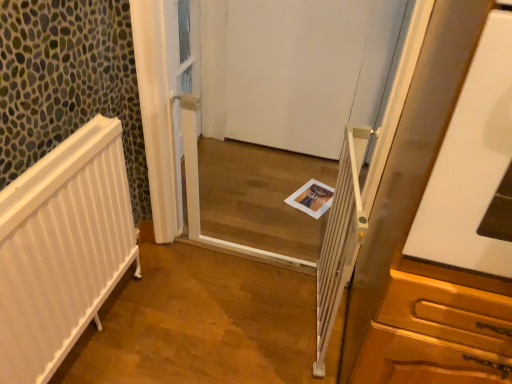
In order to face white matte radiator at left, should I rotate leftwards or rightwards?

Rotate left and turn 22.956 degrees.

The height and width of the screenshot is (384, 512). What are the coordinates of `white matte door at center` in the screenshot? It's located at (307, 70).

What do you see at coordinates (281, 115) in the screenshot? This screenshot has height=384, width=512. I see `white plastic screen door at center` at bounding box center [281, 115].

This screenshot has width=512, height=384. I want to click on white matte radiator at left, so click(62, 249).

Looking at this image, does white plastic balustrade at center touch white paper magazine at center?

No, white plastic balustrade at center is not next to white paper magazine at center.

Considering the relative positions of white plastic balustrade at center and white paper magazine at center in the image provided, is white plastic balustrade at center in front of white paper magazine at center?

Yes, white plastic balustrade at center is closer to the camera.

Is point (329, 226) farther from viewer compared to point (301, 201)?

No, it is not.

What's the angular difference between white plastic screen door at center and white matte radiator at left's facing directions?

They differ by 90.2 degrees in their facing directions.

Is white plastic screen door at center facing away from white matte radiator at left?

Yes, white matte radiator at left is at the back of white plastic screen door at center.

From the image's perspective, which one is positioned lower, white plastic screen door at center or white matte radiator at left?

white matte radiator at left is shown below in the image.

In the image, is white plastic screen door at center positioned in front of or behind white matte radiator at left?

white plastic screen door at center is positioned farther from the viewer than white matte radiator at left.

Considering the positions of point (29, 246) and point (328, 204), is point (29, 246) closer or farther from the camera than point (328, 204)?

Point (29, 246).

From the image's perspective, is white matte radiator at left beneath white paper magazine at center?

Indeed, from the image's perspective, white matte radiator at left is shown beneath white paper magazine at center.

Between white matte radiator at left and white paper magazine at center, which one has larger size?

white matte radiator at left.

Does white matte radiator at left appear on the right side of white paper magazine at center?

In fact, white matte radiator at left is to the left of white paper magazine at center.

Are white matte door at center and white paper magazine at center beside each other?

white matte door at center is not next to white paper magazine at center, and they're not touching.

Choose the correct answer: Is white matte door at center inside white paper magazine at center or outside it?

white matte door at center is located beyond the bounds of white paper magazine at center.

Could you tell me if white matte door at center is turned towards white paper magazine at center?

Yes, white matte door at center is oriented towards white paper magazine at center.

Looking at their sizes, would you say white matte door at center is wider or thinner than white paper magazine at center?

Clearly, white matte door at center has less width compared to white paper magazine at center.

Is white plastic screen door at center to the left or to the right of white matte door at center in the image?

Clearly, white plastic screen door at center is on the left of white matte door at center in the image.

Between white plastic screen door at center and white matte door at center, which one is positioned behind?

white matte door at center is behind.

Considering the relative sizes of white plastic screen door at center and white matte door at center in the image provided, is white plastic screen door at center shorter than white matte door at center?

In fact, white plastic screen door at center may be taller than white matte door at center.

Is white matte radiator at left placed right next to white matte door at center?

white matte radiator at left and white matte door at center are not in contact.

Is white matte radiator at left taller than white matte door at center?

In fact, white matte radiator at left may be shorter than white matte door at center.

Could you tell me if white matte radiator at left is turned towards white matte door at center?

No, white matte radiator at left does not turn towards white matte door at center.

Image resolution: width=512 pixels, height=384 pixels. I want to click on radiator below the white matte door at center (from the image's perspective), so click(62, 249).

In the scene shown: From the image's perspective, is white plastic balustrade at center located above white matte radiator at left?

Yes, from the image's perspective, white plastic balustrade at center is above white matte radiator at left.

The image size is (512, 384). I want to click on balustrade that appears above the white matte radiator at left (from the image's perspective), so click(x=340, y=240).

Considering the sizes of objects white plastic balustrade at center and white matte radiator at left in the image provided, who is taller, white plastic balustrade at center or white matte radiator at left?

With more height is white matte radiator at left.

Which object is more forward, white plastic balustrade at center or white matte radiator at left?

white matte radiator at left.

Identify the location of balustrade that is in front of the white paper magazine at center. (340, 240).

This screenshot has width=512, height=384. In order to click on radiator that appears below the white plastic screen door at center (from the image's perspective) in this screenshot , I will do `click(62, 249)`.

Based on their spatial positions, is white plastic screen door at center or white plastic balustrade at center closer to white matte radiator at left?

white plastic balustrade at center lies closer to white matte radiator at left than the other object.

From the image, which object appears to be nearer to white matte door at center, white matte radiator at left or white paper magazine at center?

white paper magazine at center is positioned closer to the anchor white matte door at center.

When comparing their distances from white matte radiator at left, does white plastic balustrade at center or white paper magazine at center seem further?

Based on the image, white paper magazine at center appears to be further to white matte radiator at left.

Which object lies further to the anchor point white plastic screen door at center, white plastic balustrade at center or white matte door at center?

white plastic balustrade at center.

Looking at the image, which one is located further to white plastic screen door at center, white matte radiator at left or white matte door at center?

white matte radiator at left is further to white plastic screen door at center.

Estimate the real-world distances between objects in this image. Which object is further from white plastic balustrade at center, white matte door at center or white matte radiator at left?

white matte door at center is further to white plastic balustrade at center.

In the scene shown: From the image, which object appears to be nearer to white plastic screen door at center, white paper magazine at center or white plastic balustrade at center?

white paper magazine at center lies closer to white plastic screen door at center than the other object.

Estimate the real-world distances between objects in this image. Which object is further from white matte door at center, white plastic balustrade at center or white paper magazine at center?

white plastic balustrade at center.

The height and width of the screenshot is (384, 512). I want to click on door between white plastic screen door at center and white paper magazine at center in the front-back direction, so click(307, 70).

You are a GUI agent. You are given a task and a screenshot of the screen. Output one action in this format:
    pyautogui.click(x=<x>, y=<y>)
    Task: Click on the screen door between white matte radiator at left and white plastic balustrade at center in the horizontal direction
    The height and width of the screenshot is (384, 512).
    Given the screenshot: What is the action you would take?
    pyautogui.click(x=281, y=115)

This screenshot has height=384, width=512. I want to click on balustrade located between white matte radiator at left and white matte door at center in the depth direction, so click(340, 240).

This screenshot has width=512, height=384. I want to click on door between white plastic balustrade at center and white paper magazine at center along the z-axis, so pyautogui.click(x=307, y=70).